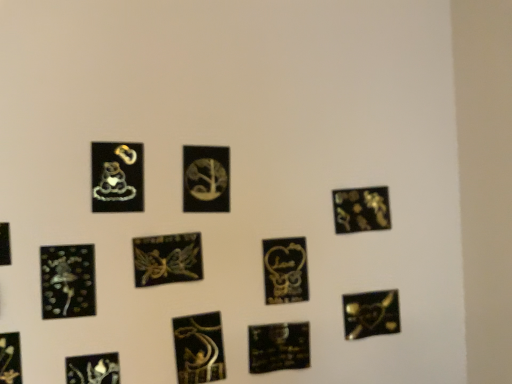
Question: Is matte black sticker at upper right, the eleventh picture frame positioned from the left, bigger than matte gold charm at upper left, placed as the 5th picture frame when sorted from left to right?

Choices:
 (A) no
 (B) yes

Answer: (B)

Question: From the image's perspective, would you say matte black sticker at upper right, the eleventh picture frame positioned from the left, is shown under matte gold charm at upper left, which is counted as the 8th picture frame, starting from the right?

Choices:
 (A) yes
 (B) no

Answer: (A)

Question: Is matte black sticker at upper right, which is the second picture frame from right to left, oriented towards matte gold charm at upper left, placed as the 5th picture frame when sorted from left to right?

Choices:
 (A) yes
 (B) no

Answer: (B)

Question: Is matte black sticker at upper right, the eleventh picture frame positioned from the left, in contact with matte gold charm at upper left, which is counted as the 8th picture frame, starting from the right?

Choices:
 (A) yes
 (B) no

Answer: (B)

Question: Can you confirm if matte black sticker at upper right, which is the second picture frame from right to left, is smaller than matte gold charm at upper left, which is counted as the 8th picture frame, starting from the right?

Choices:
 (A) no
 (B) yes

Answer: (A)

Question: From a real-world perspective, is metallic gold fairy at center, marked as the sixth picture frame in a left-to-right arrangement, above or below matte black heart at lower left, which is the 9th picture frame from right to left?

Choices:
 (A) below
 (B) above

Answer: (B)

Question: Is metallic gold fairy at center, marked as the sixth picture frame in a left-to-right arrangement, bigger or smaller than matte black heart at lower left, which is the 9th picture frame from right to left?

Choices:
 (A) small
 (B) big

Answer: (B)

Question: Considering the relative positions of metallic gold fairy at center, marked as the sixth picture frame in a left-to-right arrangement, and matte black heart at lower left, which is the 4th picture frame from left to right, in the image provided, is metallic gold fairy at center, marked as the sixth picture frame in a left-to-right arrangement, to the left or to the right of matte black heart at lower left, which is the 4th picture frame from left to right,?

Choices:
 (A) right
 (B) left

Answer: (A)

Question: In terms of width, does metallic gold fairy at center, the seventh picture frame when ordered from right to left, look wider or thinner when compared to matte black heart at lower left, which is the 9th picture frame from right to left?

Choices:
 (A) wide
 (B) thin

Answer: (A)

Question: From the image's perspective, relative to black glossy picture frame at lower left, arranged as the 1th picture frame when viewed from the left, is matte black heart at lower left, which is the 4th picture frame from left to right, above or below?

Choices:
 (A) below
 (B) above

Answer: (A)

Question: In terms of width, does matte black heart at lower left, which is the 4th picture frame from left to right, look wider or thinner when compared to black glossy picture frame at lower left, which is counted as the 12th picture frame, starting from the right?

Choices:
 (A) wide
 (B) thin

Answer: (A)

Question: Do you think matte black heart at lower left, which is the 4th picture frame from left to right, is within black glossy picture frame at lower left, arranged as the 1th picture frame when viewed from the left, or outside of it?

Choices:
 (A) outside
 (B) inside

Answer: (A)

Question: Would you say matte black heart at lower left, which is the 9th picture frame from right to left, is to the left or to the right of black glossy picture frame at lower left, arranged as the 1th picture frame when viewed from the left, in the picture?

Choices:
 (A) left
 (B) right

Answer: (B)

Question: Is gold metallic heart at lower right, the twelfth picture frame viewed from the left, inside or outside of black glossy picture frame at lower center, which is the 9th picture frame in left-to-right order?

Choices:
 (A) outside
 (B) inside

Answer: (A)

Question: In the image, is gold metallic heart at lower right, the twelfth picture frame viewed from the left, positioned in front of or behind black glossy picture frame at lower center, the 4th picture frame positioned from the right?

Choices:
 (A) behind
 (B) front

Answer: (A)